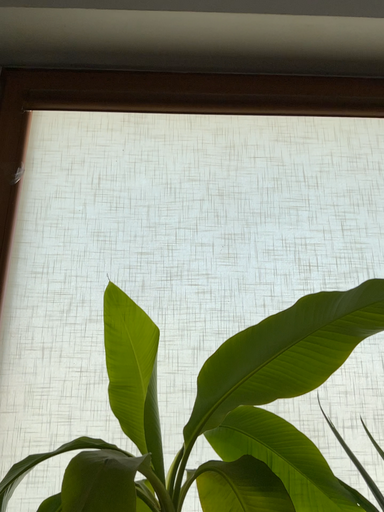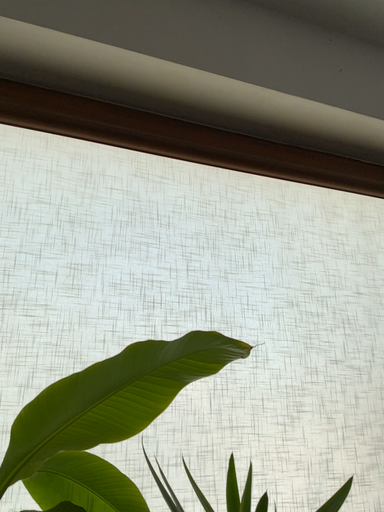
Question: How did the camera likely rotate when shooting the video?

Choices:
 (A) rotated right
 (B) rotated left

Answer: (A)